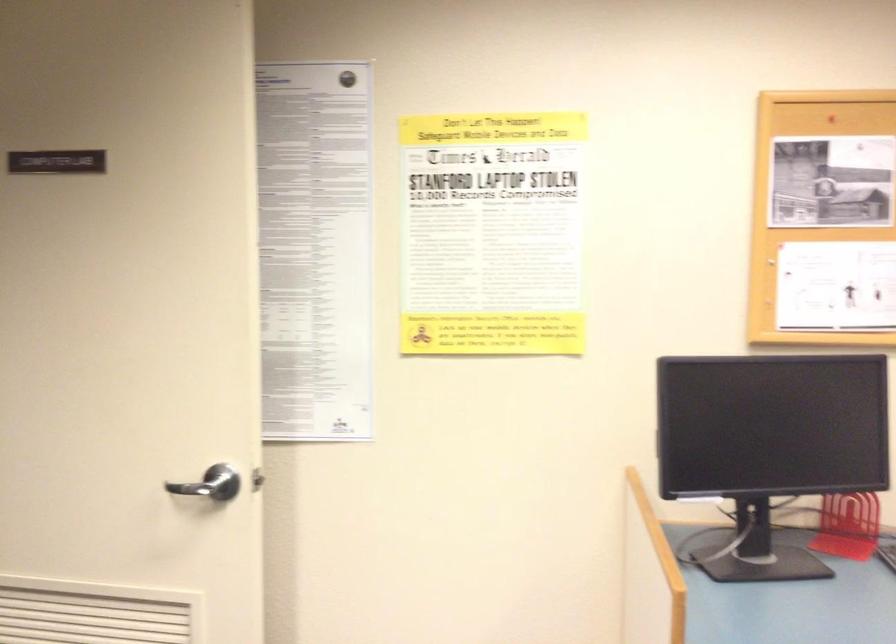
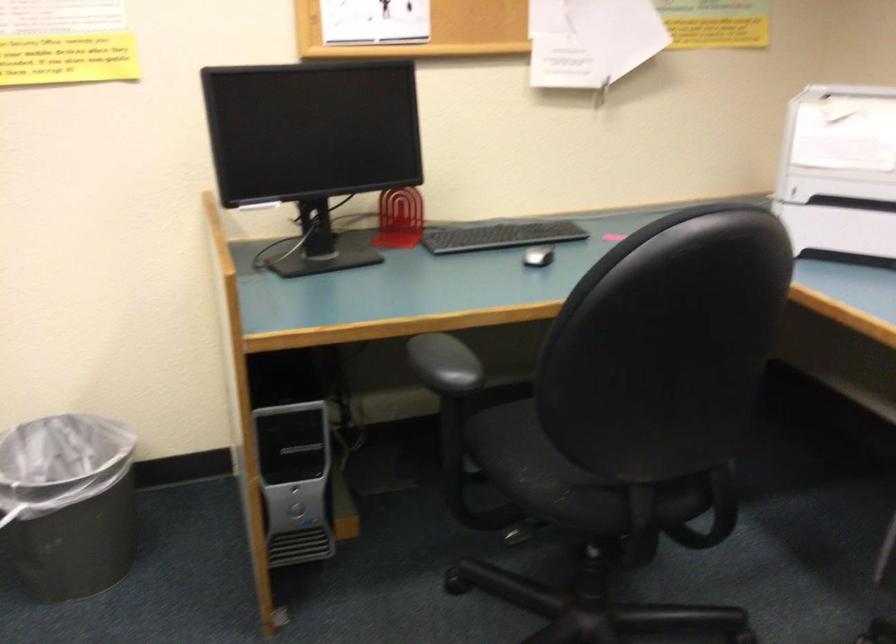
How did the camera likely rotate?

The camera's rotation is toward right-down.